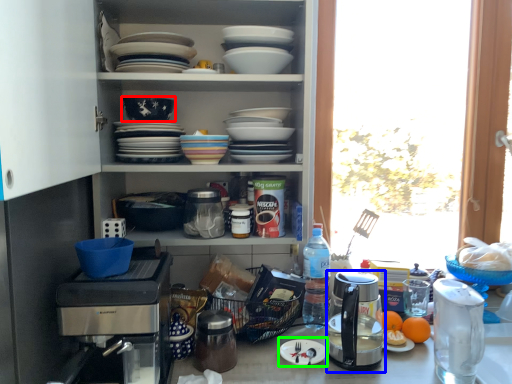
Question: Which object is positioned farthest from bowl (highlighted by a red box)? Select from kitchen appliance (highlighted by a blue box) and paper plate (highlighted by a green box).

Choices:
 (A) kitchen appliance
 (B) paper plate

Answer: (A)